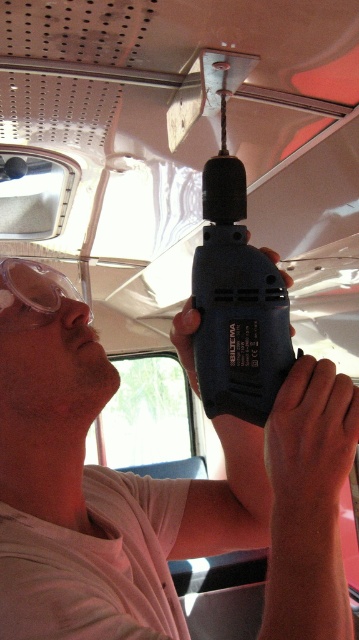
Looking at this image, is black plastic drill at center wider than clear plastic goggles at left?

No.

Which of these two, black plastic drill at center or clear plastic goggles at left, stands taller?

black plastic drill at center

At what (x,y) coordinates should I click in order to perform the action: click on black plastic drill at center. Please return your answer as a coordinate pair (x, y). This screenshot has height=640, width=359. Looking at the image, I should click on (236, 305).

Is point (231, 454) in front of point (206, 324)?

No, it is not.

Describe the element at coordinates (157, 497) in the screenshot. The height and width of the screenshot is (640, 359). I see `matte black drill at upper center` at that location.

Locate an element on the screen. The width and height of the screenshot is (359, 640). matte black drill at upper center is located at coordinates (157, 497).

Which is more to the right, matte black drill at upper center or clear plastic goggles at left?

matte black drill at upper center is more to the right.

Which is in front, point (20, 458) or point (53, 276)?

Point (20, 458) is more forward.

This screenshot has width=359, height=640. What are the coordinates of `matte black drill at upper center` in the screenshot? It's located at (157, 497).